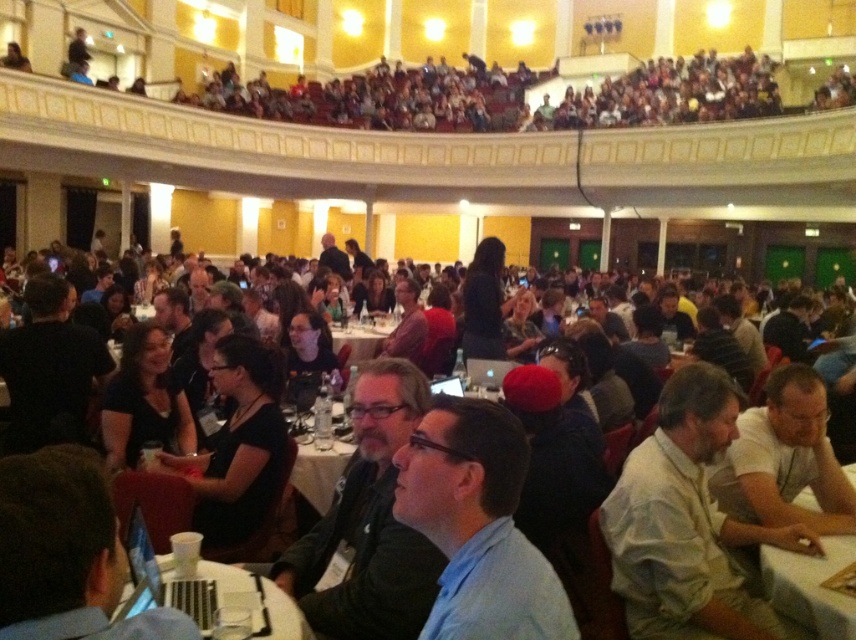
Can you confirm if white cloth table at lower right is smaller than white plastic table at lower center?

No.

Which is more to the right, white cloth table at lower right or white plastic table at lower center?

From the viewer's perspective, white cloth table at lower right appears more on the right side.

I want to click on white cloth table at lower right, so click(811, 588).

Locate an element on the screen. white cloth table at lower right is located at coordinates (811, 588).

Is white cloth table at lower right behind white plastic table at center?

That is False.

Can you confirm if white cloth table at lower right is shorter than white plastic table at center?

Yes, white cloth table at lower right is shorter than white plastic table at center.

What are the coordinates of `white cloth table at lower right` in the screenshot? It's located at (811, 588).

Consider the image. Does white plastic table at lower center have a greater width compared to white plastic table at center?

No, white plastic table at lower center is not wider than white plastic table at center.

Between white plastic table at lower center and white plastic table at center, which one has less height?

white plastic table at lower center is shorter.

This screenshot has height=640, width=856. I want to click on white plastic table at lower center, so pyautogui.click(x=257, y=600).

In order to click on white plastic table at lower center in this screenshot , I will do `click(257, 600)`.